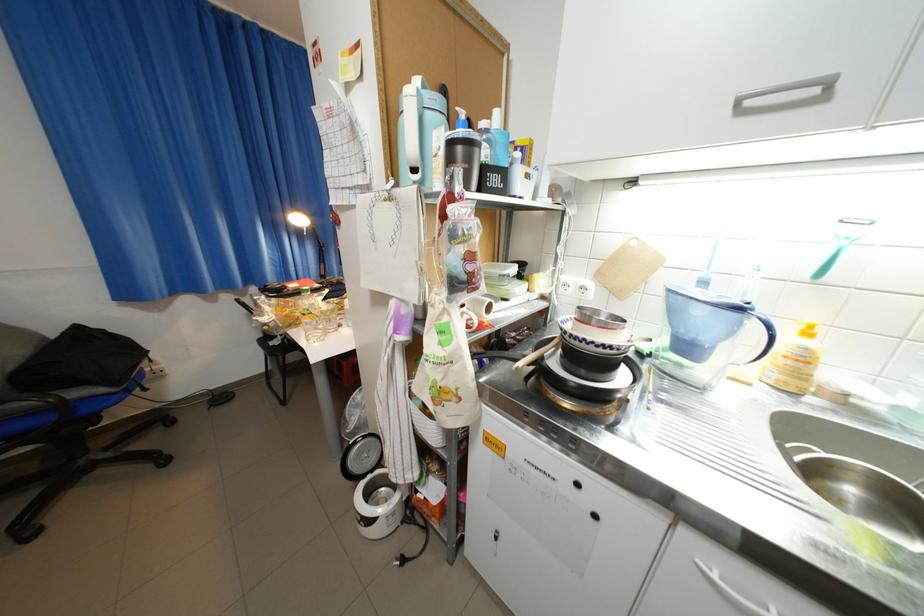
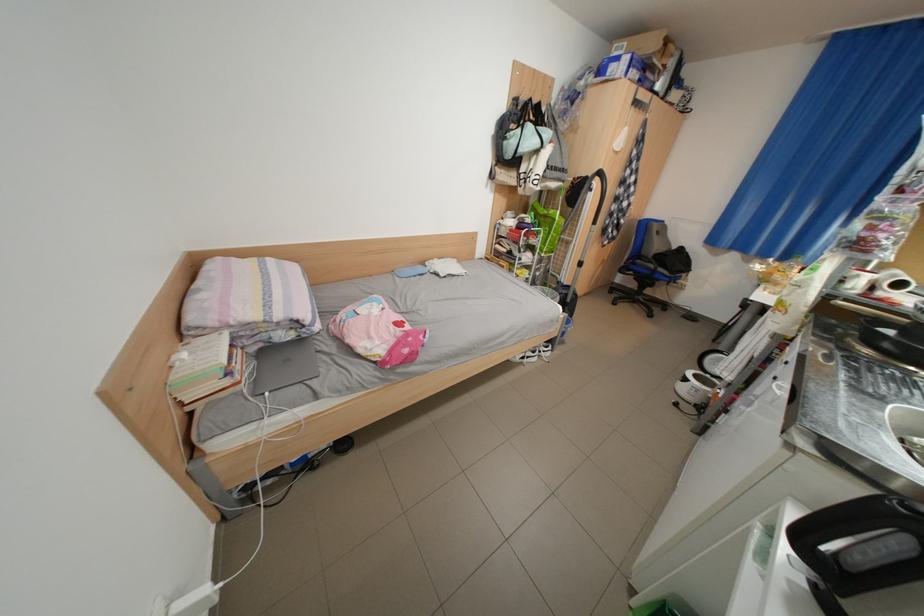
Where in the second image is the point corresponding to (x=608, y=517) from the first image?

(786, 379)